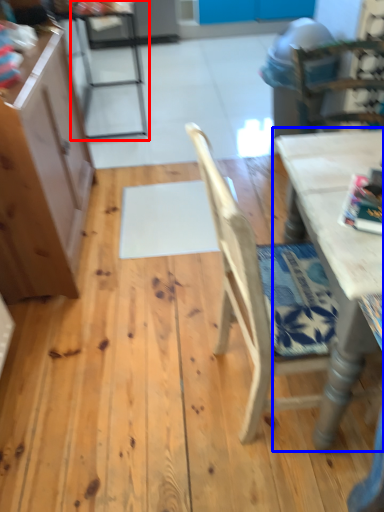
Question: Among these objects, which one is farthest to the camera, chair (highlighted by a red box) or table (highlighted by a blue box)?

Choices:
 (A) chair
 (B) table

Answer: (A)